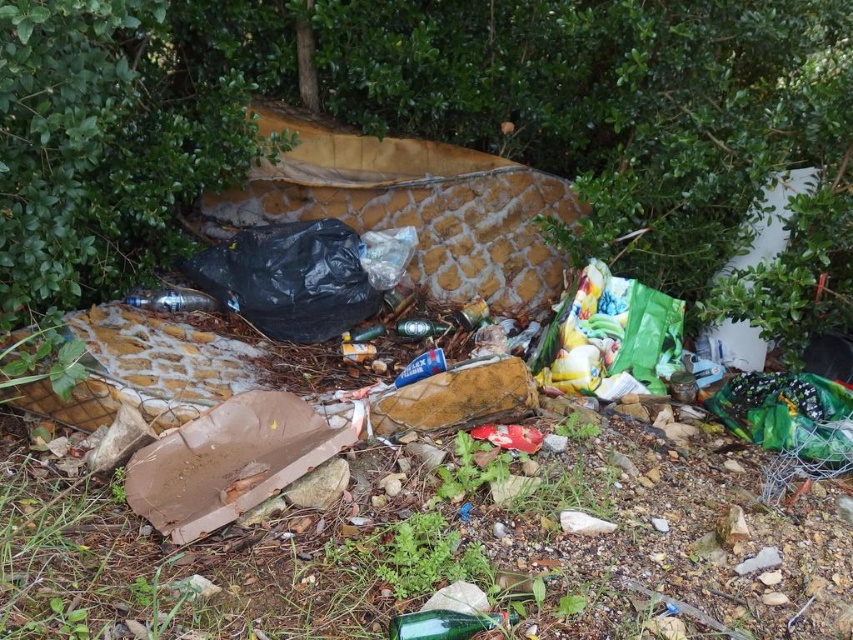
Which is more to the left, green glass bottle at lower center or green matte bottle at center?

green matte bottle at center

Does green glass bottle at lower center appear on the right side of green matte bottle at center?

Correct, you'll find green glass bottle at lower center to the right of green matte bottle at center.

Who is more distant from viewer, (416, 621) or (425, 324)?

The point (425, 324) is behind.

Locate an element on the screen. Image resolution: width=853 pixels, height=640 pixels. green glass bottle at lower center is located at coordinates (445, 625).

Is black plastic bag at center taller than green matte bottle at center?

Yes, black plastic bag at center is taller than green matte bottle at center.

Is black plastic bag at center to the left of green matte bottle at center from the viewer's perspective?

Correct, you'll find black plastic bag at center to the left of green matte bottle at center.

What are the coordinates of `black plastic bag at center` in the screenshot? It's located at (289, 278).

Can you confirm if green glass bottle at lower center is wider than translucent plastic bottle at center?

No, green glass bottle at lower center is not wider than translucent plastic bottle at center.

Who is positioned more to the left, green glass bottle at lower center or translucent plastic bottle at center?

translucent plastic bottle at center

What are the coordinates of `green glass bottle at lower center` in the screenshot? It's located at (445, 625).